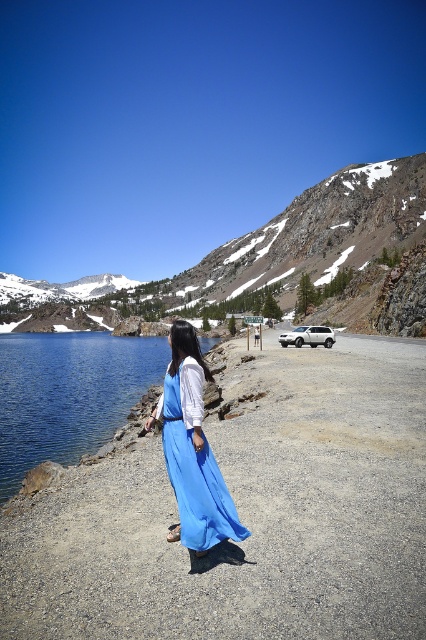
Is blue fabric dress at center positioned in front of blue satin dress at center?

Yes.

Is point (393, 371) more distant than point (184, 397)?

Yes, point (393, 371) is farther from viewer.

Locate an element on the screen. Image resolution: width=426 pixels, height=640 pixels. blue fabric dress at center is located at coordinates (245, 515).

Looking at this image, does blue fabric dress at center have a larger size compared to blue glassy water at lower left?

Actually, blue fabric dress at center might be smaller than blue glassy water at lower left.

Can you confirm if blue fabric dress at center is smaller than blue glassy water at lower left?

Indeed, blue fabric dress at center has a smaller size compared to blue glassy water at lower left.

Which is in front, point (373, 385) or point (13, 348)?

Point (373, 385) is more forward.

Find the location of `blue fabric dress at center`. blue fabric dress at center is located at coordinates (245, 515).

Who is shorter, blue glassy water at lower left or blue satin dress at center?

blue glassy water at lower left is shorter.

Between blue glassy water at lower left and blue satin dress at center, which one has more height?

blue satin dress at center

This screenshot has height=640, width=426. Describe the element at coordinates (68, 394) in the screenshot. I see `blue glassy water at lower left` at that location.

At what (x,y) coordinates should I click in order to perform the action: click on blue glassy water at lower left. Please return your answer as a coordinate pair (x, y). This screenshot has width=426, height=640. Looking at the image, I should click on (68, 394).